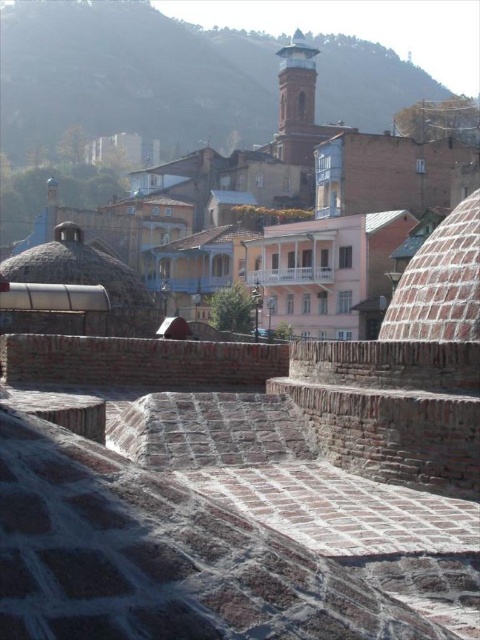
You are a tourist standing at the entrance of the historic area and want to take a photo that includes both the brown brick town at center and the smooth brick tower at upper center. Based on their positions, which one should you position to the right side of your camera frame to include both in the shot?

To include both the brown brick town at center and the smooth brick tower at upper center in your photo, you should position the brown brick town at center to the right side of your camera frame because it is located to the left of the smooth brick tower at upper center, so placing it on the right would ensure both are captured.

You are a tourist standing on the stone pathway in the historic area. You notice the brown brick town at center and the smooth brick tower at upper center. Which of these two structures has a greater width?

The brown brick town at center has a greater width than the smooth brick tower at upper center because the brown brick town at center surpasses the smooth brick tower at upper center in width.

You are standing at the point marked by the coordinates point (303,179) in the historic urban area. What structure are you directly facing?

The point (303,179) marks the brown brick town at center, so you are directly facing the brown brick town at center.